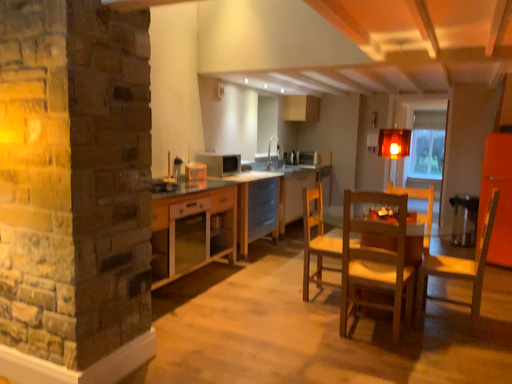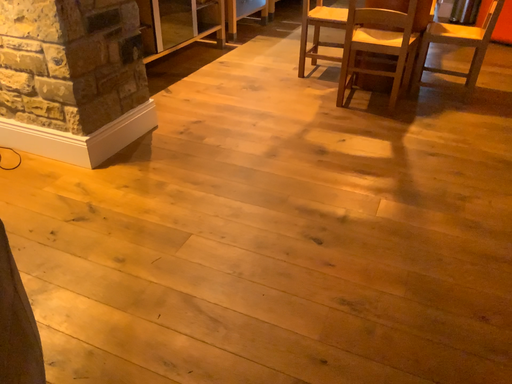
Question: Which way did the camera rotate in the video?

Choices:
 (A) rotated upward
 (B) rotated downward

Answer: (B)